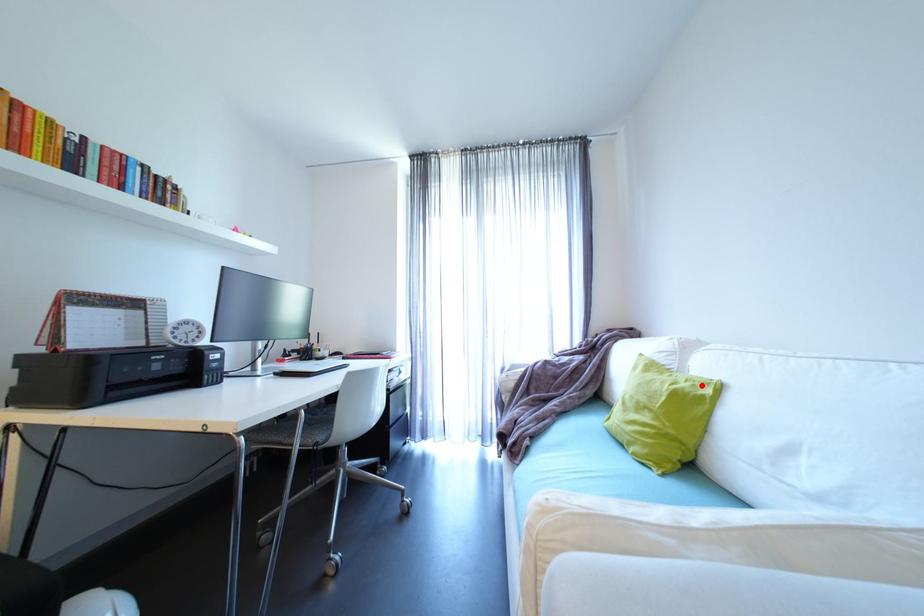
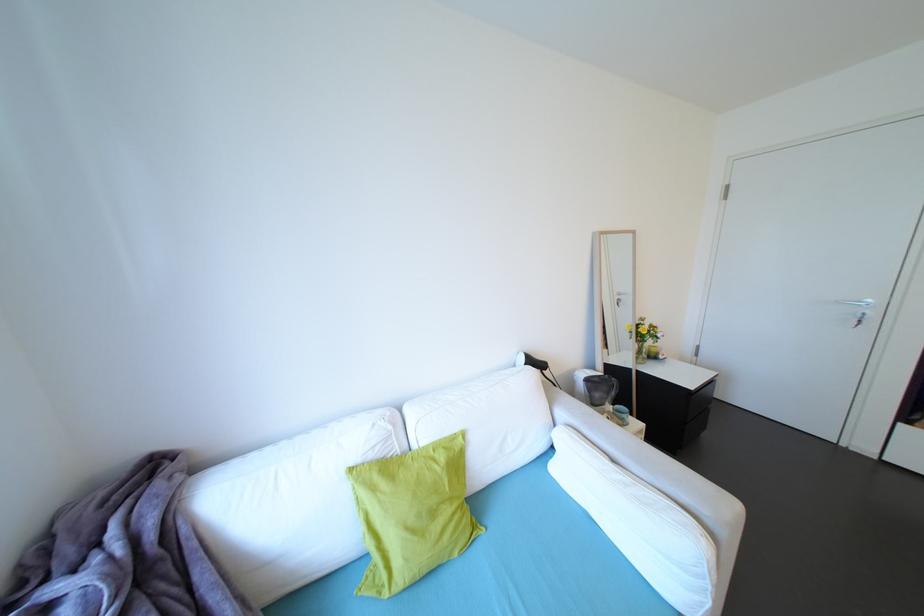
In the second image, find the point that corresponds to the highlighted location in the first image.

(451, 448)